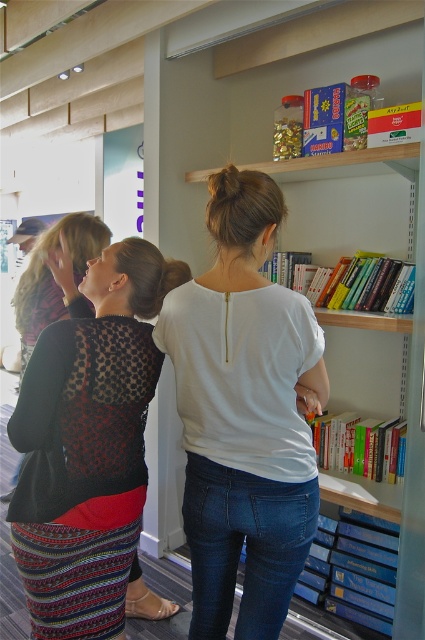
How distant is white matte shirt at center from patterned fabric dress at left?

93.28 centimeters

Who is taller, white matte shirt at center or patterned fabric dress at left?

Standing taller between the two is white matte shirt at center.

Is point (181, 349) farther from camera compared to point (31, 321)?

No.

Where is `white matte shirt at center`? The height and width of the screenshot is (640, 425). white matte shirt at center is located at coordinates (244, 413).

You are a GUI agent. You are given a task and a screenshot of the screen. Output one action in this format:
    pyautogui.click(x=<x>, y=<y>)
    Task: Click on the black lace top at left
    Image resolution: width=425 pixels, height=640 pixels.
    Given the screenshot: What is the action you would take?
    pyautogui.click(x=93, y=429)

Is point (138, 376) less distant than point (73, 253)?

That is True.

Identify the location of black lace top at left. The width and height of the screenshot is (425, 640). pyautogui.click(x=93, y=429).

Between white matte shirt at center and black lace top at left, which one appears on the left side from the viewer's perspective?

black lace top at left is more to the left.

Can you confirm if white matte shirt at center is thinner than black lace top at left?

In fact, white matte shirt at center might be wider than black lace top at left.

Measure the distance between point (x=181, y=387) and camera.

The distance of point (x=181, y=387) from camera is 4.53 feet.

Find the location of a particular element. The width and height of the screenshot is (425, 640). white matte shirt at center is located at coordinates (244, 413).